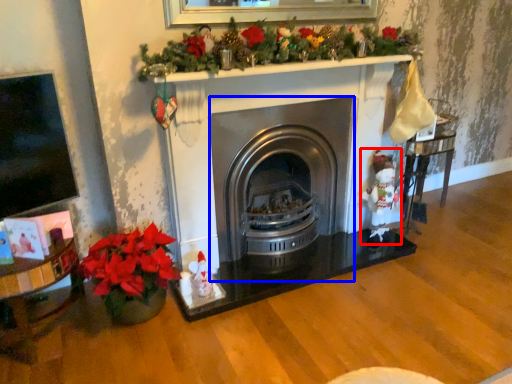
Question: Among these objects, which one is farthest to the camera, santa claus (highlighted by a red box) or wood burning stove (highlighted by a blue box)?

Choices:
 (A) santa claus
 (B) wood burning stove

Answer: (A)